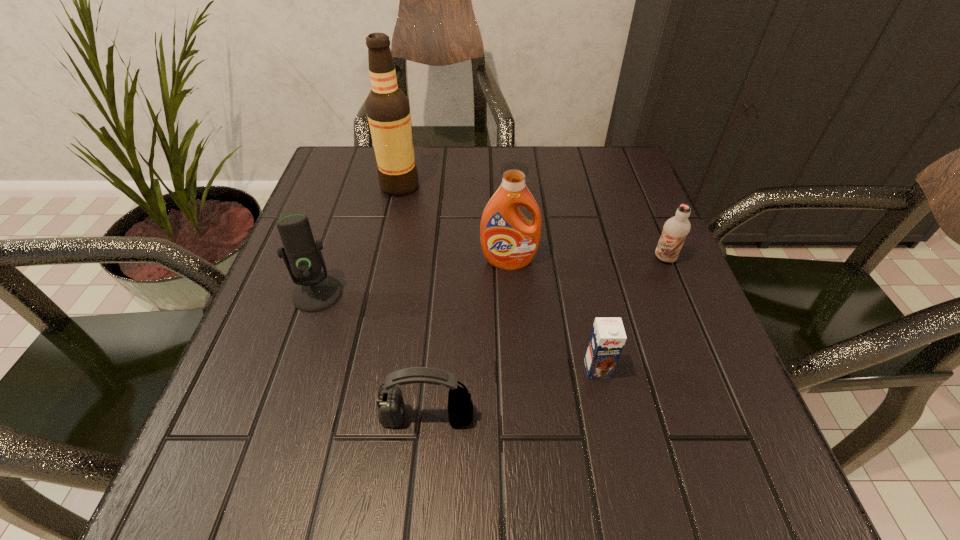
The width and height of the screenshot is (960, 540). Identify the location of vacant space that satisfies the following two spatial constraints: 1. on the back side of the right chocolate milk; 2. on the label of the farthest object. (634, 186).